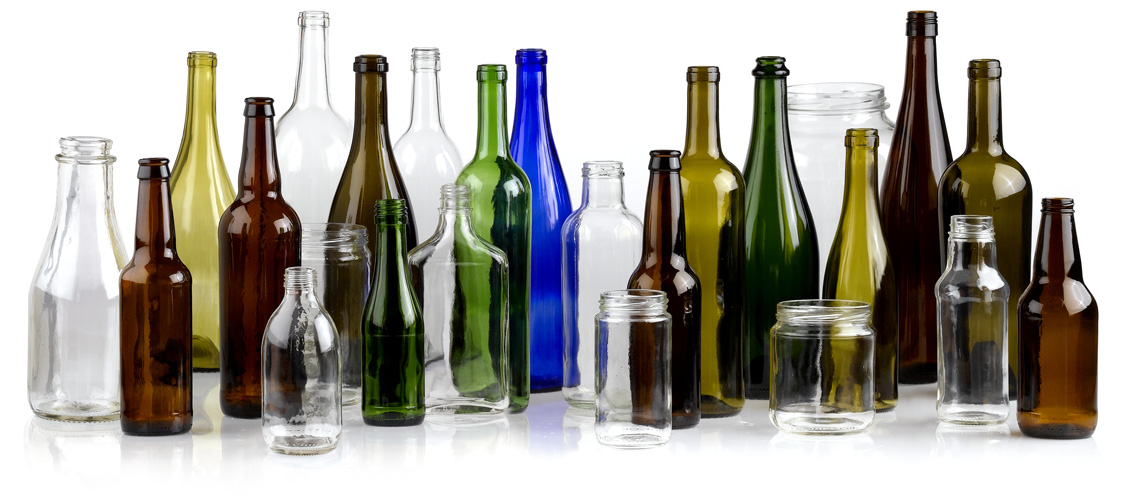
This screenshot has height=500, width=1123. Find the location of `brown glass containers`. brown glass containers is located at coordinates (158, 304), (255, 235), (366, 185), (652, 240), (914, 177), (1065, 323).